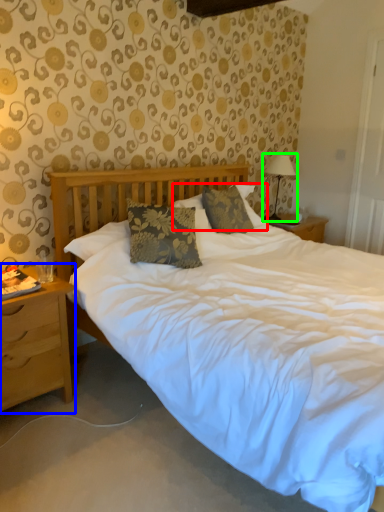
Question: Based on their relative distances, which object is nearer to pillow (highlighted by a red box)? Choose from nightstand (highlighted by a blue box) and table lamp (highlighted by a green box).

Choices:
 (A) nightstand
 (B) table lamp

Answer: (B)